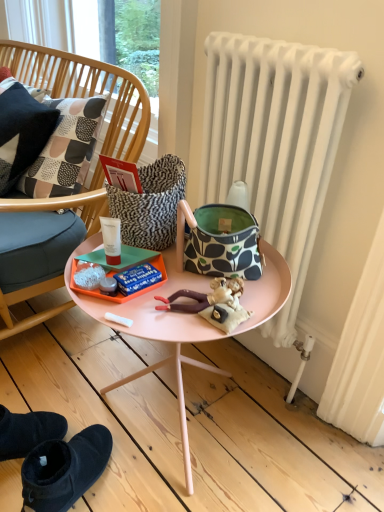
What is the approximate height of wooden chair at left?

wooden chair at left is 25.17 inches in height.

What is the approximate width of pink matte table at center?

pink matte table at center is 20.63 inches in width.

Where is `wooden chair at left`? This screenshot has width=384, height=512. wooden chair at left is located at coordinates (84, 89).

Is pink matte table at center not within patterned fabric pillow at left?

Indeed, pink matte table at center is completely outside patterned fabric pillow at left.

Is pink matte table at center facing towards patterned fabric pillow at left?

No, pink matte table at center is not aimed at patterned fabric pillow at left.

In the image, there is a patterned fabric pillow at left. Find the location of `table below it (from the image's perspective)`. table below it (from the image's perspective) is located at coordinates (155, 327).

Do you think white matte radiator at right is within patterned fabric handbag at center, or outside of it?

white matte radiator at right is spatially situated outside patterned fabric handbag at center.

From the image's perspective, between white matte radiator at right and patterned fabric handbag at center, which one is located above?

white matte radiator at right, from the image's perspective.

Does point (231, 98) come farther from viewer compared to point (234, 243)?

Yes, it is behind point (234, 243).

Which of these two, white matte radiator at right or patterned fabric handbag at center, is thinner?

white matte radiator at right.

Based on the photo, which object is further away from the camera, wooden chair at left or pink matte table at center?

wooden chair at left.

Image resolution: width=384 pixels, height=512 pixels. In order to click on chair located on the left of pink matte table at center in this screenshot , I will do `click(84, 89)`.

Who is bigger, wooden chair at left or pink matte table at center?

pink matte table at center.

Considering the relative sizes of pink matte table at center and wooden chair at left in the image provided, is pink matte table at center wider than wooden chair at left?

Yes.

Between pink matte table at center and wooden chair at left, which one has more height?

With more height is wooden chair at left.

From the image's perspective, is pink matte table at center above or below wooden chair at left?

From the image's perspective, pink matte table at center appears below wooden chair at left.

Considering the relative sizes of wooden chair at left and white matte radiator at right in the image provided, is wooden chair at left wider than white matte radiator at right?

Indeed, wooden chair at left has a greater width compared to white matte radiator at right.

The width and height of the screenshot is (384, 512). Identify the location of radiator in front of the wooden chair at left. (276, 142).

Which point is more distant from viewer, (x=101, y=63) or (x=239, y=102)?

The point (x=101, y=63) is farther from the camera.

Is wooden chair at left touching white matte radiator at right?

No, wooden chair at left is not next to white matte radiator at right.

From their relative heights in the image, would you say patterned fabric pillow at left is taller or shorter than wooden chair at left?

In the image, patterned fabric pillow at left appears to be shorter than wooden chair at left.

Considering the positions of objects patterned fabric pillow at left and wooden chair at left in the image provided, who is in front, patterned fabric pillow at left or wooden chair at left?

wooden chair at left is more forward.

From the image's perspective, is patterned fabric pillow at left located above or below wooden chair at left?

Clearly, from the image's perspective, patterned fabric pillow at left is above wooden chair at left.

In the scene shown: From a real-world perspective, who is located higher, patterned fabric pillow at left or wooden chair at left?

patterned fabric pillow at left, from a real-world perspective.

From the image's perspective, is patterned fabric handbag at center beneath wooden chair at left?

Indeed, from the image's perspective, patterned fabric handbag at center is shown beneath wooden chair at left.

Is patterned fabric handbag at center positioned with its back to wooden chair at left?

patterned fabric handbag at center is not turned away from wooden chair at left.

Considering the sizes of objects patterned fabric handbag at center and wooden chair at left in the image provided, who is shorter, patterned fabric handbag at center or wooden chair at left?

With less height is patterned fabric handbag at center.

Considering the sizes of objects patterned fabric handbag at center and wooden chair at left in the image provided, who is smaller, patterned fabric handbag at center or wooden chair at left?

Smaller between the two is patterned fabric handbag at center.

This screenshot has width=384, height=512. In order to click on pillow lying above the pink matte table at center (from the image's perspective) in this screenshot , I will do `click(21, 133)`.

Where is `handbag above the white matte radiator at right (from a real-world perspective)`? This screenshot has width=384, height=512. handbag above the white matte radiator at right (from a real-world perspective) is located at coordinates (219, 245).

When comparing their distances from pink matte table at center, does white matte radiator at right or patterned fabric pillow at left seem closer?

white matte radiator at right lies closer to pink matte table at center than the other object.

Based on their spatial positions, is white matte radiator at right or wooden chair at left further from patterned fabric pillow at left?

white matte radiator at right is positioned further to the anchor patterned fabric pillow at left.

Estimate the real-world distances between objects in this image. Which object is further from pink matte table at center, patterned fabric handbag at center or wooden chair at left?

wooden chair at left.

From the image, which object appears to be farther from white matte radiator at right, wooden chair at left or patterned fabric pillow at left?

The object further to white matte radiator at right is patterned fabric pillow at left.

Considering their positions, is wooden chair at left positioned closer to pink matte table at center than white matte radiator at right?

white matte radiator at right is positioned closer to the anchor pink matte table at center.

Considering their positions, is white matte radiator at right positioned closer to patterned fabric pillow at left than pink matte table at center?

pink matte table at center is positioned closer to the anchor patterned fabric pillow at left.

Which object lies nearer to the anchor point white matte radiator at right, patterned fabric pillow at left or patterned fabric handbag at center?

patterned fabric handbag at center is positioned closer to the anchor white matte radiator at right.

Looking at the image, which one is located closer to white matte radiator at right, wooden chair at left or patterned fabric handbag at center?

The object closer to white matte radiator at right is patterned fabric handbag at center.

The height and width of the screenshot is (512, 384). I want to click on chair situated between patterned fabric pillow at left and patterned fabric handbag at center from left to right, so click(84, 89).

I want to click on handbag between white matte radiator at right and pink matte table at center in the up-down direction, so click(219, 245).

Where is `handbag between patterned fabric pillow at left and white matte radiator at right`? The height and width of the screenshot is (512, 384). handbag between patterned fabric pillow at left and white matte radiator at right is located at coordinates (219, 245).

Identify the location of chair between patterned fabric pillow at left and white matte radiator at right from left to right. (84, 89).